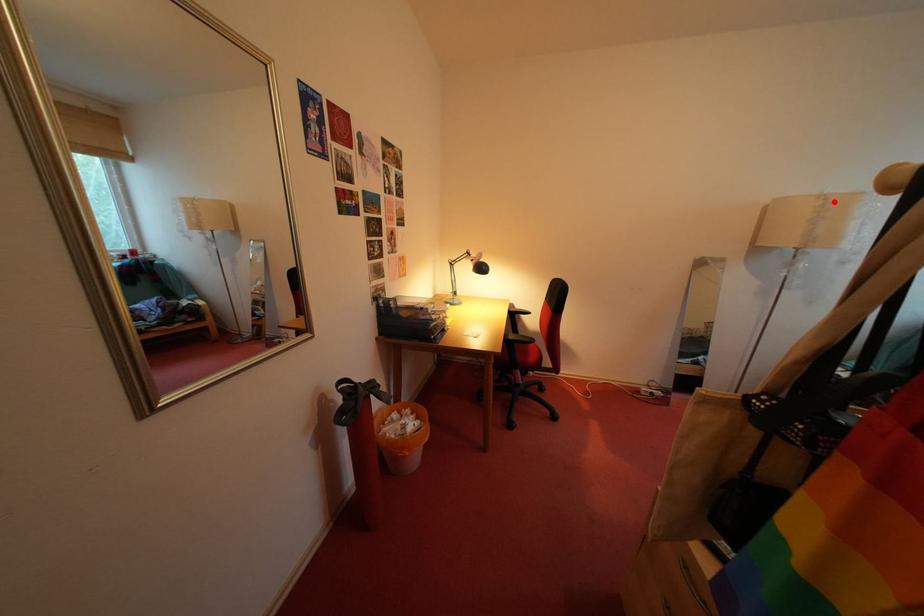
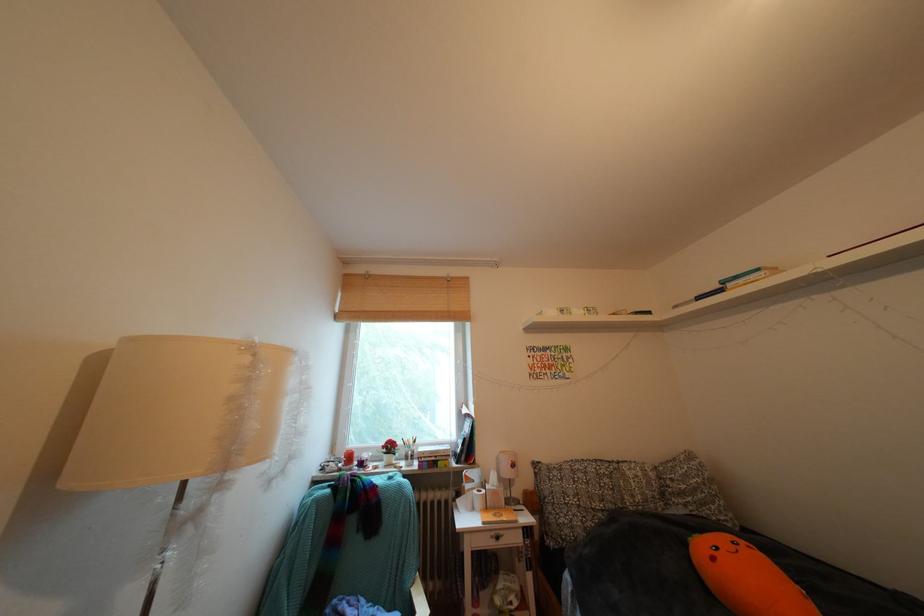
In the second image, find the point that corresponds to the highlighted location in the first image.

(259, 353)